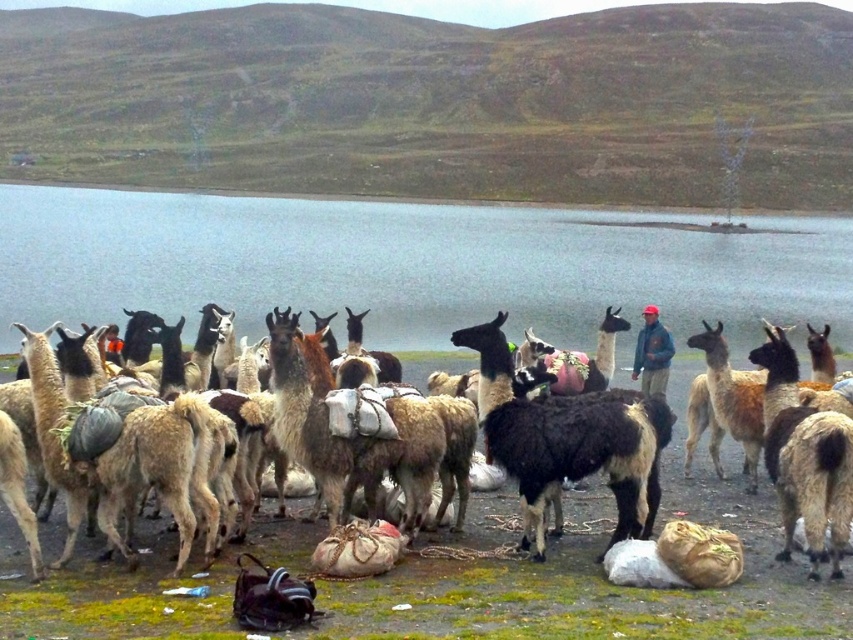
You are a hiker who wants to take a photo of the black and white woolen alpaca at center and the dark blue jacket at center. Based on their positions, which object is closer to the camera?

The black and white woolen alpaca at center is positioned under the dark blue jacket at center, meaning the alpaca is closer to the camera than the jacket.

You are a hiker who wants to cross the blue water at center. You see the black and white woolen alpaca at center. Which direction should you walk to get closer to the water?

The blue water at center is further to the viewer than the black and white woolen alpaca at center, so you should walk away from the alpaca to reach the water.